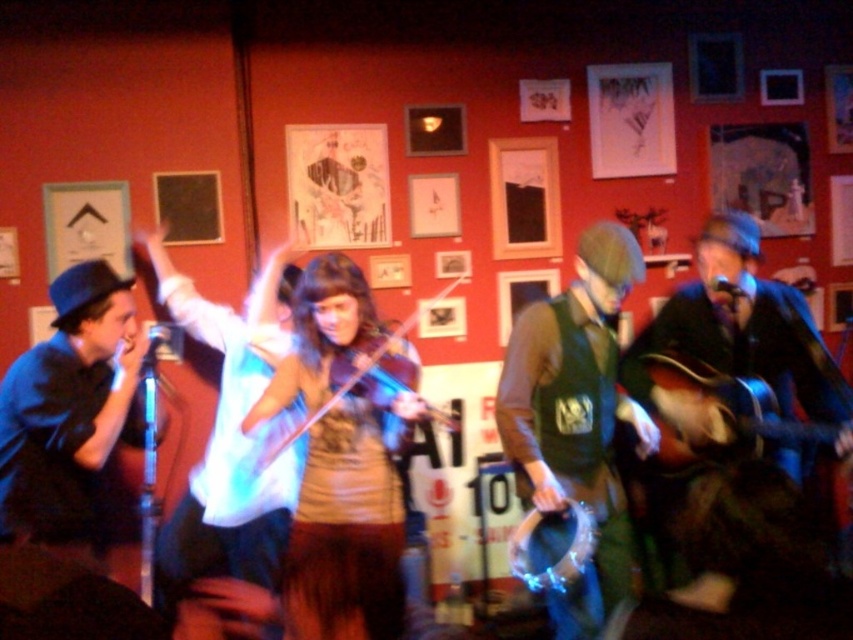
Question: Does wooden acoustic guitar at right have a larger size compared to shiny brown violin at center?

Choices:
 (A) no
 (B) yes

Answer: (B)

Question: Does shiny gold dress at center have a larger size compared to wooden acoustic guitar at center?

Choices:
 (A) yes
 (B) no

Answer: (B)

Question: Considering the real-world distances, which object is farthest from the wooden acoustic guitar at right?

Choices:
 (A) shiny brown violin at center
 (B) wooden acoustic guitar at center

Answer: (A)

Question: Is shiny gold dress at center to the left of wooden acoustic guitar at center from the viewer's perspective?

Choices:
 (A) yes
 (B) no

Answer: (A)

Question: Which object is positioned farthest from the wooden acoustic guitar at center?

Choices:
 (A) wooden acoustic guitar at right
 (B) shiny brown violin at center

Answer: (B)

Question: Which of the following is the closest to the observer?

Choices:
 (A) shiny gold dress at center
 (B) wooden acoustic guitar at center
 (C) wooden acoustic guitar at right
 (D) shiny brown violin at center

Answer: (A)